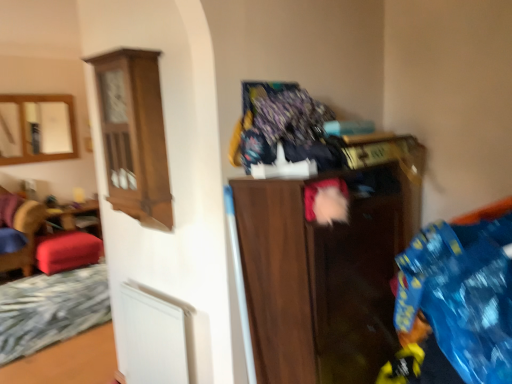
Question: Is dark wood cabinet at center inside or outside of fluffy multicolored blanket at upper center?

Choices:
 (A) outside
 (B) inside

Answer: (A)

Question: From a real-world perspective, is dark wood cabinet at center positioned above or below fluffy multicolored blanket at upper center?

Choices:
 (A) below
 (B) above

Answer: (A)

Question: Estimate the real-world distances between objects in this image. Which object is closer to the white matte bed frame at lower left?

Choices:
 (A) fluffy multicolored blanket at upper center
 (B) matte wood mirror at upper left
 (C) velvet red stool at left
 (D) wooden cabinet at left
 (E) dark wood cabinet at center

Answer: (C)

Question: Estimate the real-world distances between objects in this image. Which object is closer to the dark wood cabinet at center?

Choices:
 (A) wooden cabinet at left
 (B) fluffy multicolored blanket at upper center
 (C) matte wood mirror at upper left
 (D) velvet red stool at left
 (E) white matte bed frame at lower left

Answer: (B)